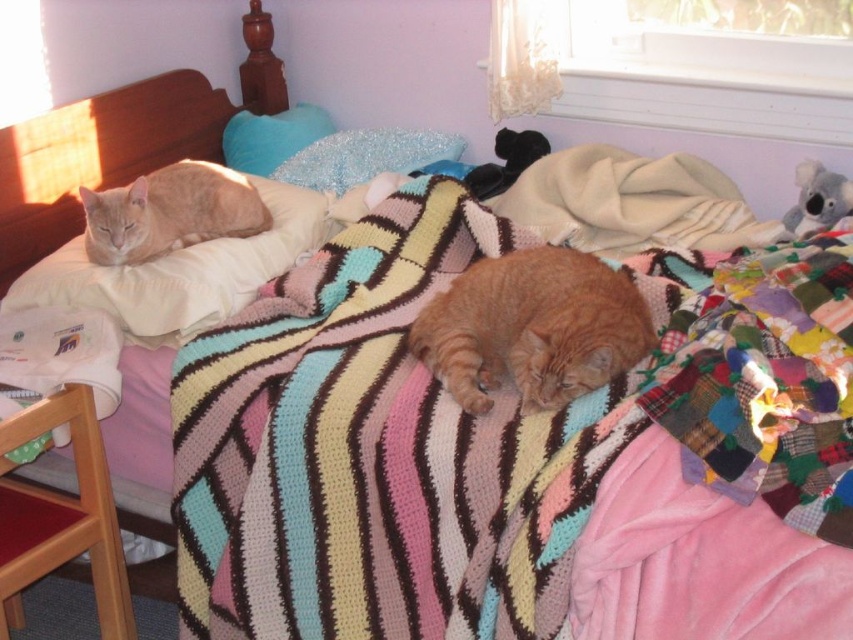
You are arranging a photo shoot in this bedroom and need to place two pillows on the bed. The photographer wants to know which pillow is wider. Which one is wider between the white soft pillow at upper left and the sparkly blue pillow at upper center?

The white soft pillow at upper left is wider than the sparkly blue pillow at upper center according to the description.

You are arranging flowers on a table in the bedroom. You have two pillows to place on the table. The white soft pillow at upper left and the blue fuzzy pillow at upper center. According to the scene, where should each pillow be placed relative to each other?

The white soft pillow at upper left should be placed below the blue fuzzy pillow at upper center as per the scene description.

You are a photographer trying to capture a closeup of the blue fuzzy pillow at upper center. You see the orange fur cat at upper left in the way. Can you move the cat to the right side of the pillow without moving the pillow? Explain why or why not based on their current positions.

The orange fur cat at upper left is currently to the left of the blue fuzzy pillow at upper center. Since the cat is already positioned to the left of the pillow, moving it to the right side of the pillow would require shifting its location relative to the pillow. However, the question specifies not moving the pillow, so this adjustment is possible as long as there is space available on the right side of the pillow for the cat to move into. The spatial arrangement allows this movement as the cat is not affi